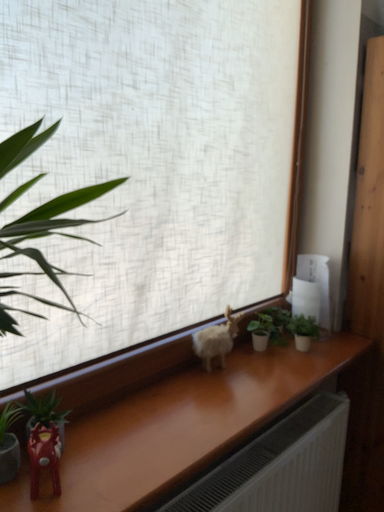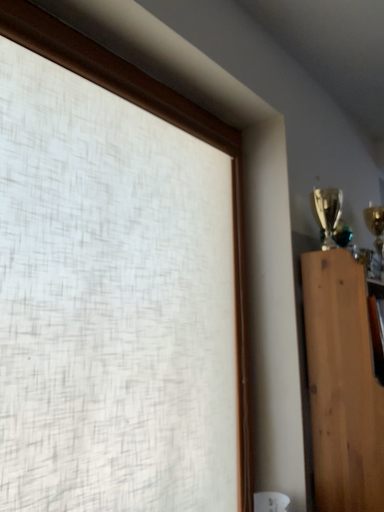
Question: Which way did the camera rotate in the video?

Choices:
 (A) rotated downward
 (B) rotated upward

Answer: (B)